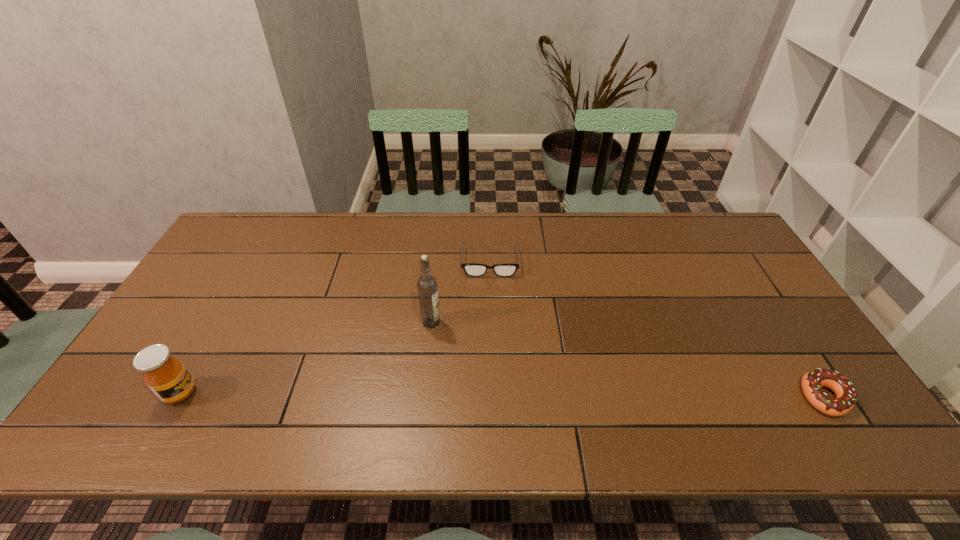
Identify the location of vacant space located 0.140m on the label of the tallest object. (472, 357).

The width and height of the screenshot is (960, 540). I want to click on free space located on the label of the tallest object, so click(x=462, y=348).

I want to click on free space located on the front-facing side of the third object from left to right, so click(x=491, y=338).

This screenshot has width=960, height=540. I want to click on free space located on the front-facing side of the third object from left to right, so click(491, 316).

Find the location of a particular element. This screenshot has height=540, width=960. free space located 0.230m on the front-facing side of the third object from left to right is located at coordinates (491, 335).

Locate an element on the screen. The height and width of the screenshot is (540, 960). object at the far edge is located at coordinates (471, 269).

Image resolution: width=960 pixels, height=540 pixels. I want to click on honey located at the near edge, so click(x=167, y=377).

At what (x,y) coordinates should I click in order to perform the action: click on doughnut located at the near edge. Please return your answer as a coordinate pair (x, y). Looking at the image, I should click on (812, 382).

I want to click on object that is at the left edge, so click(x=167, y=377).

Image resolution: width=960 pixels, height=540 pixels. Identify the location of object that is at the right edge. (812, 382).